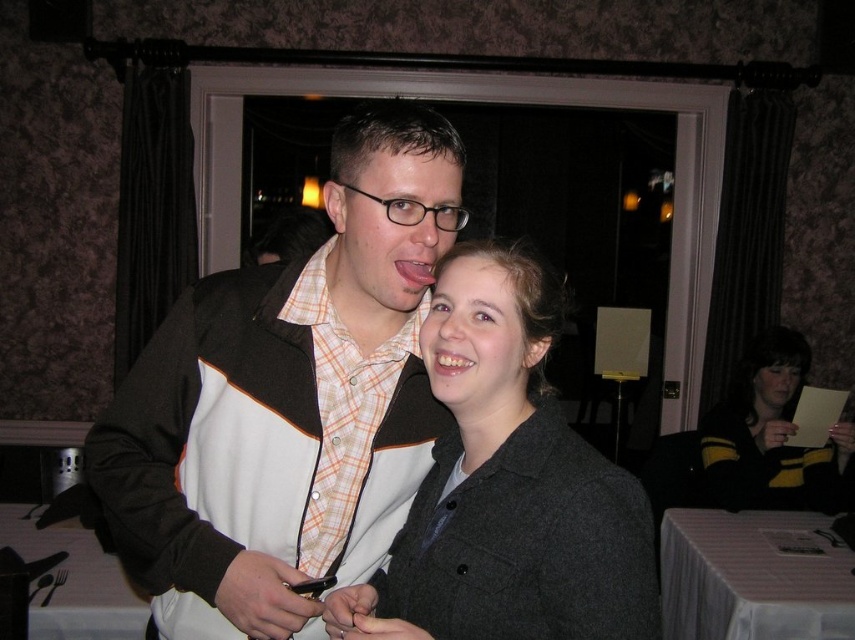
Question: Among these objects, which one is farthest from the camera?

Choices:
 (A) yellow-black sweater at lower right
 (B) matte brown jacket at center
 (C) matte gray coat at center

Answer: (A)

Question: Is matte gray coat at center wider than yellow-black sweater at lower right?

Choices:
 (A) yes
 (B) no

Answer: (B)

Question: Is matte brown jacket at center closer to the viewer compared to matte gray coat at center?

Choices:
 (A) no
 (B) yes

Answer: (A)

Question: Which point appears farthest from the camera in this image?

Choices:
 (A) (335, 269)
 (B) (481, 552)
 (C) (771, 390)

Answer: (C)

Question: Which of the following is the closest to the observer?

Choices:
 (A) yellow-black sweater at lower right
 (B) matte brown jacket at center

Answer: (B)

Question: Is matte brown jacket at center bigger than matte gray coat at center?

Choices:
 (A) yes
 (B) no

Answer: (A)